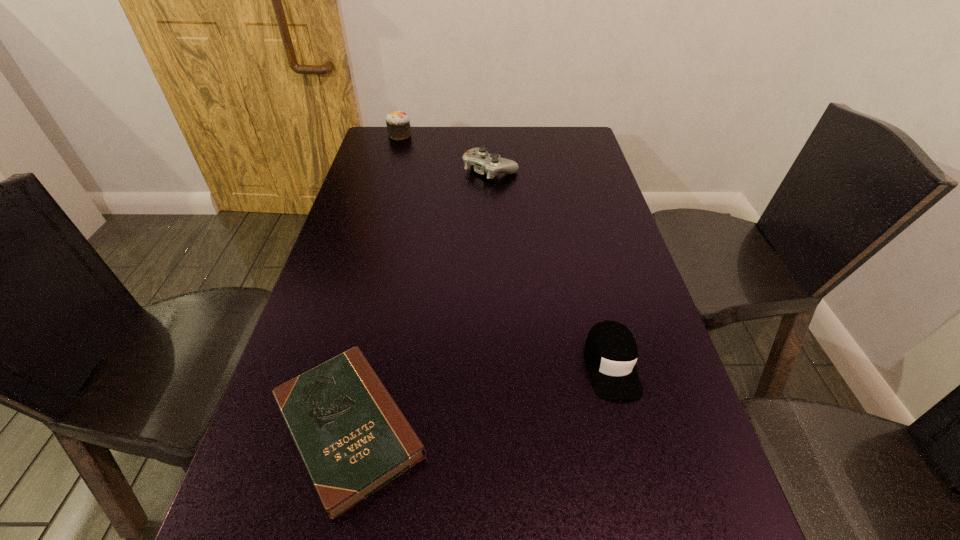
The width and height of the screenshot is (960, 540). I want to click on cupcake at the far edge, so click(x=398, y=126).

I want to click on control located at the far edge, so click(x=492, y=164).

Locate an element on the screen. The image size is (960, 540). cupcake that is at the left edge is located at coordinates (398, 126).

Where is `Bible present at the left edge`? The width and height of the screenshot is (960, 540). Bible present at the left edge is located at coordinates (353, 439).

Identify the location of object that is positioned at the right edge. 611,350.

The width and height of the screenshot is (960, 540). What are the coordinates of `object that is at the far left corner` in the screenshot? It's located at (398, 126).

This screenshot has width=960, height=540. I want to click on free region at the far edge, so click(x=528, y=133).

Locate an element on the screen. vacant space at the left edge of the desktop is located at coordinates (358, 305).

This screenshot has width=960, height=540. In order to click on vacant space at the right edge of the desktop in this screenshot , I will do `click(585, 240)`.

The height and width of the screenshot is (540, 960). In order to click on free space at the far left corner in this screenshot , I will do `click(387, 157)`.